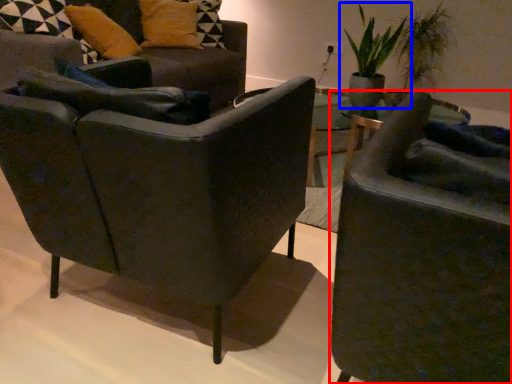
Question: Which object is closer to the camera taking this photo, chair (highlighted by a red box) or houseplant (highlighted by a blue box)?

Choices:
 (A) chair
 (B) houseplant

Answer: (A)